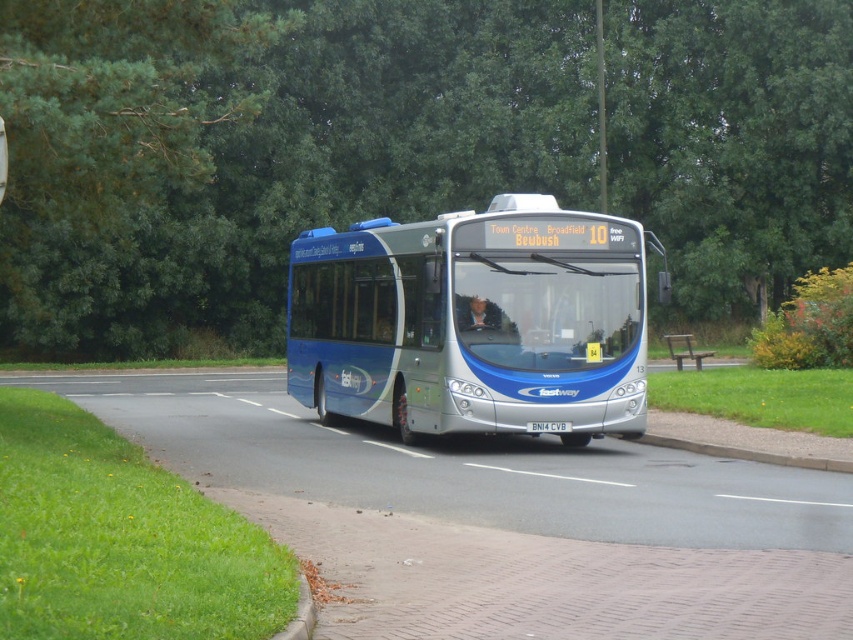
Which of these two, matte blue bus at center or brown wooden bench at lower right, stands taller?

matte blue bus at center is taller.

In the scene shown: Does matte blue bus at center appear on the right side of brown wooden bench at lower right?

Incorrect, matte blue bus at center is not on the right side of brown wooden bench at lower right.

What do you see at coordinates (474, 321) in the screenshot? I see `matte blue bus at center` at bounding box center [474, 321].

Locate an element on the screen. The height and width of the screenshot is (640, 853). matte blue bus at center is located at coordinates (474, 321).

Between green leafy tree at upper center and brown wooden bench at lower right, which one is positioned lower?

brown wooden bench at lower right is below.

Can you confirm if green leafy tree at upper center is shorter than brown wooden bench at lower right?

No.

Measure the distance between green leafy tree at upper center and camera.

The distance of green leafy tree at upper center from camera is 37.16 feet.

The height and width of the screenshot is (640, 853). In order to click on green leafy tree at upper center in this screenshot , I will do `click(259, 148)`.

Who is shorter, green leafy tree at upper center or matte blue bus at center?

With less height is matte blue bus at center.

Which is more to the right, green leafy tree at upper center or matte blue bus at center?

matte blue bus at center is more to the right.

Measure the distance between green leafy tree at upper center and camera.

The distance of green leafy tree at upper center from camera is 11.33 meters.

Locate an element on the screen. The image size is (853, 640). green leafy tree at upper center is located at coordinates (259, 148).